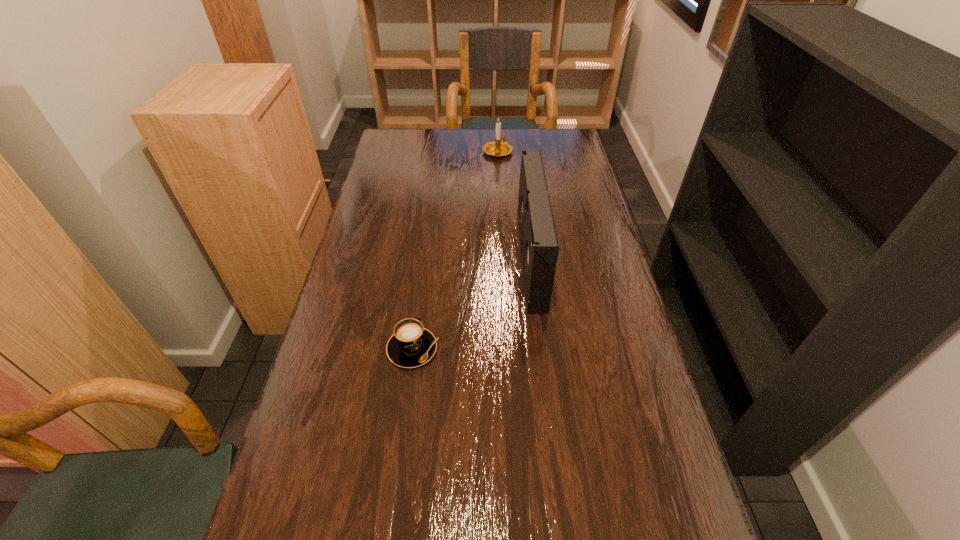
At what (x,y) coordinates should I click in order to perform the action: click on vacant space located on the back of the leftmost object. Please return your answer as a coordinate pair (x, y). Looking at the image, I should click on (426, 246).

At what (x,y) coordinates should I click in order to perform the action: click on object that is at the far edge. Please return your answer as a coordinate pair (x, y). Looking at the image, I should click on pyautogui.click(x=500, y=147).

Where is `object at the left edge`? The image size is (960, 540). object at the left edge is located at coordinates (411, 345).

Image resolution: width=960 pixels, height=540 pixels. In the image, there is a desktop. In order to click on vacant space at the far edge in this screenshot , I will do [521, 151].

In the image, there is a desktop. At what (x,y) coordinates should I click in order to perform the action: click on blank space at the left edge. Please return your answer as a coordinate pair (x, y). Image resolution: width=960 pixels, height=540 pixels. Looking at the image, I should click on (357, 225).

Identify the location of free space at the right edge of the desktop. The image size is (960, 540). (601, 219).

In the image, there is a desktop. Where is `blank space at the far left corner`? blank space at the far left corner is located at coordinates (396, 143).

In the image, there is a desktop. Where is `vacant area at the far right corner`? This screenshot has height=540, width=960. vacant area at the far right corner is located at coordinates (558, 130).

At what (x,y) coordinates should I click in order to perform the action: click on vacant space that is in between the tallest object and the nearest object. Please return your answer as a coordinate pair (x, y). Looking at the image, I should click on (471, 304).

Locate an element on the screen. The width and height of the screenshot is (960, 540). free space between the videotape and the candle holder is located at coordinates (515, 205).